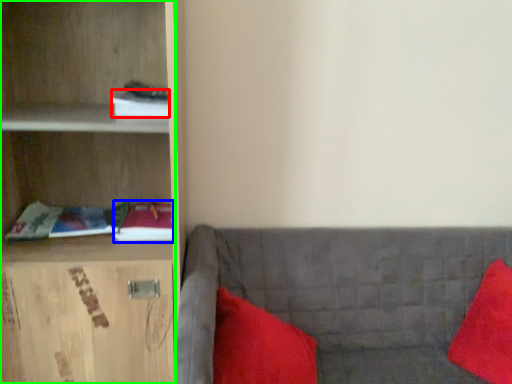
Question: Which object is the closest to the book (highlighted by a red box)? Choose among these: book (highlighted by a blue box) or cabinetry (highlighted by a green box).

Choices:
 (A) book
 (B) cabinetry

Answer: (B)